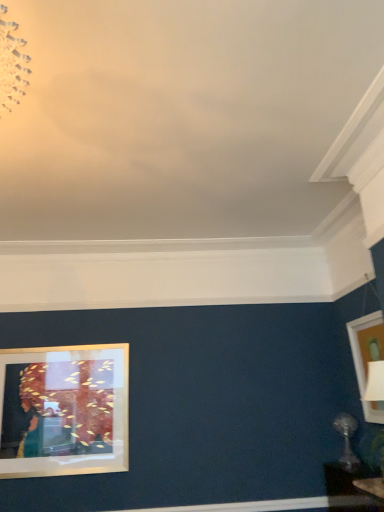
At what (x,y) coordinates should I click in order to perform the action: click on matte black table at lower right. Please return your answer as a coordinate pair (x, y). Looking at the image, I should click on (348, 489).

In order to face matte gold picture frame at upper right, should I rotate leftwards or rightwards?

You should rotate right by 23.132 degrees.

What do you see at coordinates (366, 344) in the screenshot?
I see `matte gold picture frame at upper right` at bounding box center [366, 344].

Locate an element on the screen. The width and height of the screenshot is (384, 512). matte black table at lower right is located at coordinates (348, 489).

From a real-world perspective, is matte black table at lower right positioned above or below matte gold picture frame at upper right?

In terms of real-world spatial position, matte black table at lower right is below matte gold picture frame at upper right.

Looking at their sizes, would you say matte black table at lower right is wider or thinner than matte gold picture frame at upper right?

Considering their sizes, matte black table at lower right looks broader than matte gold picture frame at upper right.

Would you say matte black table at lower right is outside matte gold picture frame at upper right?

Yes, matte black table at lower right is outside of matte gold picture frame at upper right.

Looking at this image, from a real-world perspective, is matte gold picture frame at upper right positioned above or below matte black table at lower right?

Clearly, from a real-world perspective, matte gold picture frame at upper right is above matte black table at lower right.

Is matte gold picture frame at upper right surrounding matte black table at lower right?

No.

Which point is more forward, (376, 409) or (374, 511)?

The point (374, 511) is more forward.

From a real-world perspective, is satin silver table lamp at lower right physically below matte gold picture frame at upper right?

Yes, from a real-world perspective, satin silver table lamp at lower right is under matte gold picture frame at upper right.

Between point (352, 463) and point (382, 323), which one is positioned in front?

The point (382, 323) is closer to the camera.

How far apart are satin silver table lamp at lower right and matte gold picture frame at upper right?

satin silver table lamp at lower right is 18.52 inches from matte gold picture frame at upper right.

Is satin silver table lamp at lower right next to matte gold picture frame at upper right and touching it?

No, satin silver table lamp at lower right is not with matte gold picture frame at upper right.

Is there a large distance between matte gold picture frame at upper right and satin silver table lamp at lower right?

That's not correct — matte gold picture frame at upper right is a little close to satin silver table lamp at lower right.

Considering the relative sizes of matte gold picture frame at upper right and satin silver table lamp at lower right in the image provided, is matte gold picture frame at upper right shorter than satin silver table lamp at lower right?

Incorrect, the height of matte gold picture frame at upper right does not fall short of that of satin silver table lamp at lower right.

Considering the relative sizes of matte gold picture frame at upper right and satin silver table lamp at lower right in the image provided, is matte gold picture frame at upper right bigger than satin silver table lamp at lower right?

Yes, matte gold picture frame at upper right is bigger than satin silver table lamp at lower right.

Identify the location of table lamp below the matte gold picture frame at upper right (from the image's perspective). The width and height of the screenshot is (384, 512). (347, 440).

Between satin silver table lamp at lower right and matte black table at lower right, which one has more height?

With more height is matte black table at lower right.

Is the surface of satin silver table lamp at lower right in direct contact with matte black table at lower right?

No, satin silver table lamp at lower right is not making contact with matte black table at lower right.

From the image's perspective, which is above, satin silver table lamp at lower right or matte black table at lower right?

satin silver table lamp at lower right, from the image's perspective.

From the image's perspective, between matte black table at lower right and satin silver table lamp at lower right, which one is located above?

From the image's view, satin silver table lamp at lower right is above.

Looking at the image, does matte black table at lower right seem bigger or smaller compared to satin silver table lamp at lower right?

In the image, matte black table at lower right appears to be larger than satin silver table lamp at lower right.

In terms of height, does matte black table at lower right look taller or shorter compared to satin silver table lamp at lower right?

matte black table at lower right is taller than satin silver table lamp at lower right.

From a real-world perspective, which object rests below the other?

In real-world perspective, matte black table at lower right is lower.

At what (x,y) coordinates should I click in order to perform the action: click on picture frame above the matte black table at lower right (from the image's perspective). Please return your answer as a coordinate pair (x, y). Image resolution: width=384 pixels, height=512 pixels. Looking at the image, I should click on (366, 344).

Where is `table below the matte gold picture frame at upper right (from a real-world perspective)`? Image resolution: width=384 pixels, height=512 pixels. table below the matte gold picture frame at upper right (from a real-world perspective) is located at coordinates tap(348, 489).

Considering their positions, is satin silver table lamp at lower right positioned closer to matte black table at lower right than matte gold picture frame at upper right?

satin silver table lamp at lower right is closer to matte black table at lower right.

When comparing their distances from matte gold picture frame at upper right, does matte black table at lower right or satin silver table lamp at lower right seem further?

matte black table at lower right.

Considering their positions, is satin silver table lamp at lower right positioned closer to matte gold picture frame at upper right than matte black table at lower right?

satin silver table lamp at lower right lies closer to matte gold picture frame at upper right than the other object.

Which object lies further to the anchor point satin silver table lamp at lower right, matte black table at lower right or matte gold picture frame at upper right?

The object further to satin silver table lamp at lower right is matte gold picture frame at upper right.

Looking at this image, estimate the real-world distances between objects in this image. Which object is further from satin silver table lamp at lower right, matte gold picture frame at upper right or matte black table at lower right?

The object further to satin silver table lamp at lower right is matte gold picture frame at upper right.

Considering their positions, is matte gold picture frame at upper right positioned closer to matte black table at lower right than satin silver table lamp at lower right?

satin silver table lamp at lower right is closer to matte black table at lower right.

At what (x,y) coordinates should I click in order to perform the action: click on picture frame between matte black table at lower right and satin silver table lamp at lower right along the z-axis. Please return your answer as a coordinate pair (x, y). Looking at the image, I should click on (366, 344).